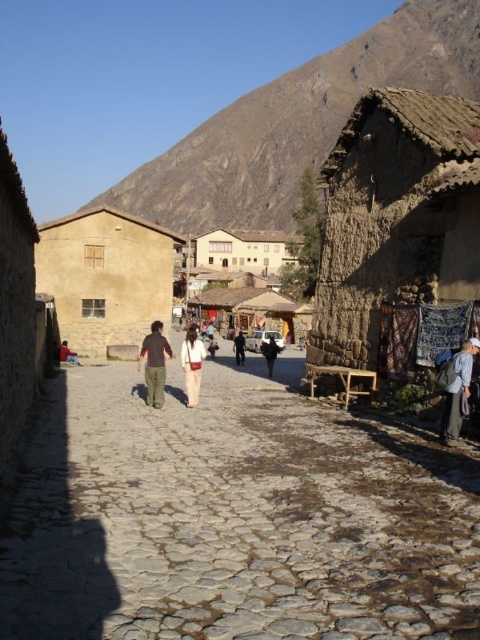
Does dark blue jeans at center have a greater height compared to dark gray fabric bag at lower left?

Correct, dark blue jeans at center is much taller as dark gray fabric bag at lower left.

Is dark blue jeans at center wider than dark gray fabric bag at lower left?

Incorrect, dark blue jeans at center's width does not surpass dark gray fabric bag at lower left's.

Who is more distant from viewer, (240, 358) or (64, 346)?

The point (64, 346) is more distant.

Where is `dark blue jeans at center`? This screenshot has height=640, width=480. dark blue jeans at center is located at coordinates (240, 348).

From the picture: Does beige stucco hut at center have a greater height compared to light beige cotton pants at center?

Yes, beige stucco hut at center is taller than light beige cotton pants at center.

Can you confirm if beige stucco hut at center is smaller than light beige cotton pants at center?

Actually, beige stucco hut at center might be larger than light beige cotton pants at center.

Identify the location of beige stucco hut at center. This screenshot has width=480, height=640. (106, 276).

Does brown rocky mountain at upper center have a larger size compared to dark blue jeans at center?

Correct, brown rocky mountain at upper center is larger in size than dark blue jeans at center.

You are a GUI agent. You are given a task and a screenshot of the screen. Output one action in this format:
    pyautogui.click(x=<x>, y=<y>)
    Task: Click on the brown rocky mountain at upper center
    The image size is (480, 640).
    Given the screenshot: What is the action you would take?
    pyautogui.click(x=298, y=122)

Find the location of a particular element. This screenshot has height=640, width=480. brown rocky mountain at upper center is located at coordinates (298, 122).